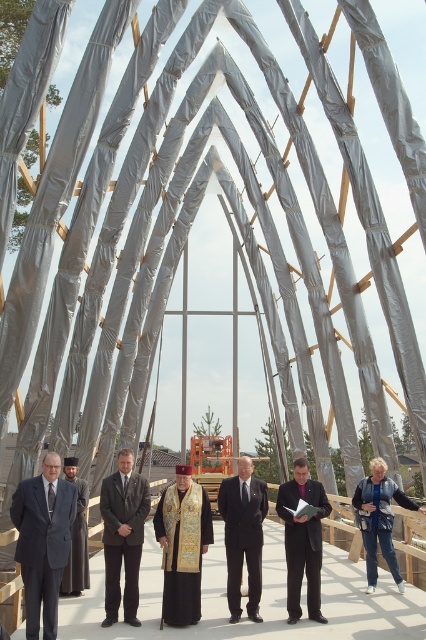
In the scene shown: Between dark gray suit at left and black suit at center, which one appears on the right side from the viewer's perspective?

From the viewer's perspective, black suit at center appears more on the right side.

Which of these two, dark gray suit at left or black suit at center, stands shorter?

Standing shorter between the two is dark gray suit at left.

Which is behind, point (52, 481) or point (247, 536)?

The point (247, 536) is behind.

At what (x,y) coordinates should I click in order to perform the action: click on dark gray suit at left. Please return your answer as a coordinate pair (x, y). This screenshot has height=640, width=426. Looking at the image, I should click on (43, 541).

Does gold embroidered vestment at center appear over dark suit at center?

Correct, gold embroidered vestment at center is located above dark suit at center.

Is gold embroidered vestment at center to the left of dark suit at center from the viewer's perspective?

Indeed, gold embroidered vestment at center is positioned on the left side of dark suit at center.

Describe the element at coordinates (183, 547) in the screenshot. I see `gold embroidered vestment at center` at that location.

This screenshot has width=426, height=640. I want to click on gold embroidered vestment at center, so [183, 547].

Is dark gray suit at center closer to the viewer compared to dark suit at center?

Yes, it is.

Does dark gray suit at center have a lesser width compared to dark suit at center?

No.

Who is more forward, (124, 477) or (296, 497)?

Positioned in front is point (124, 477).

The image size is (426, 640). Find the location of `dark gray suit at center`. dark gray suit at center is located at coordinates (123, 536).